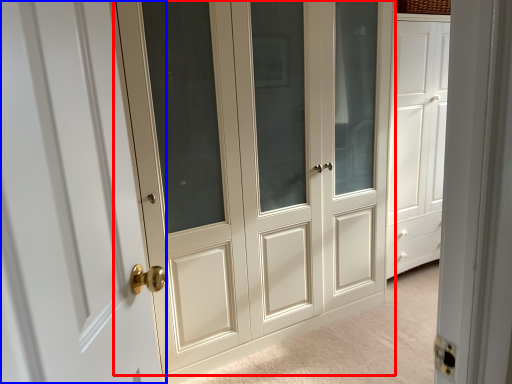
Question: Which object is further to the camera taking this photo, door (highlighted by a red box) or door (highlighted by a blue box)?

Choices:
 (A) door
 (B) door

Answer: (A)